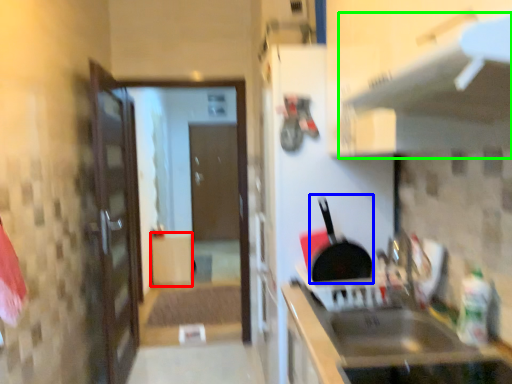
Question: Estimate the real-world distances between objects in this image. Which object is farther from cabinetry (highlighted by a red box), frying pan (highlighted by a blue box) or exhaust hood (highlighted by a green box)?

Choices:
 (A) frying pan
 (B) exhaust hood

Answer: (B)